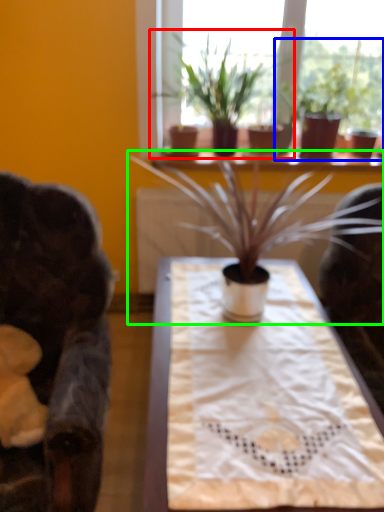
Question: Based on their relative distances, which object is nearer to houseplant (highlighted by a red box)? Choose from houseplant (highlighted by a blue box) and houseplant (highlighted by a green box).

Choices:
 (A) houseplant
 (B) houseplant

Answer: (A)